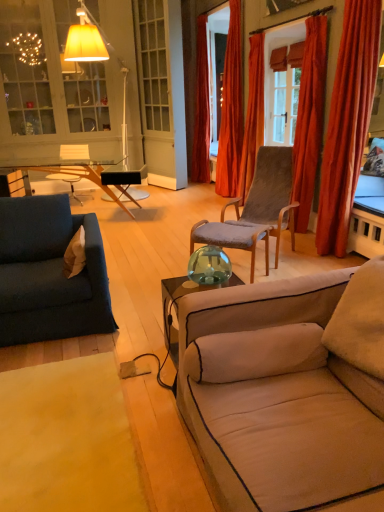
I want to click on free space above beige carpet at lower left (from a real-world perspective), so click(60, 426).